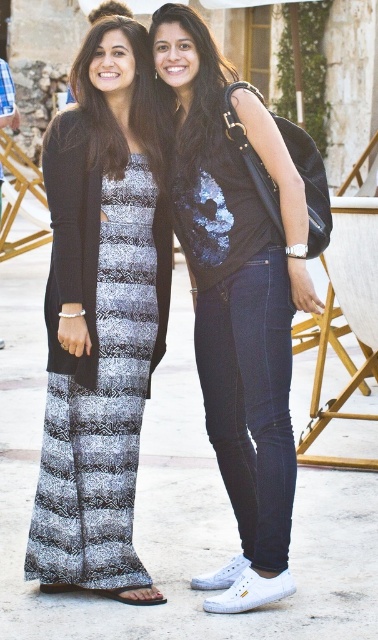
Question: Can you confirm if patterned fabric dress at left is positioned above matte black vest at center?

Choices:
 (A) yes
 (B) no

Answer: (B)

Question: Does patterned fabric dress at left appear under matte black vest at center?

Choices:
 (A) yes
 (B) no

Answer: (A)

Question: Is patterned fabric dress at left wider than matte black vest at center?

Choices:
 (A) yes
 (B) no

Answer: (B)

Question: Which of the following is the farthest from the observer?

Choices:
 (A) patterned fabric dress at left
 (B) matte black vest at center

Answer: (A)